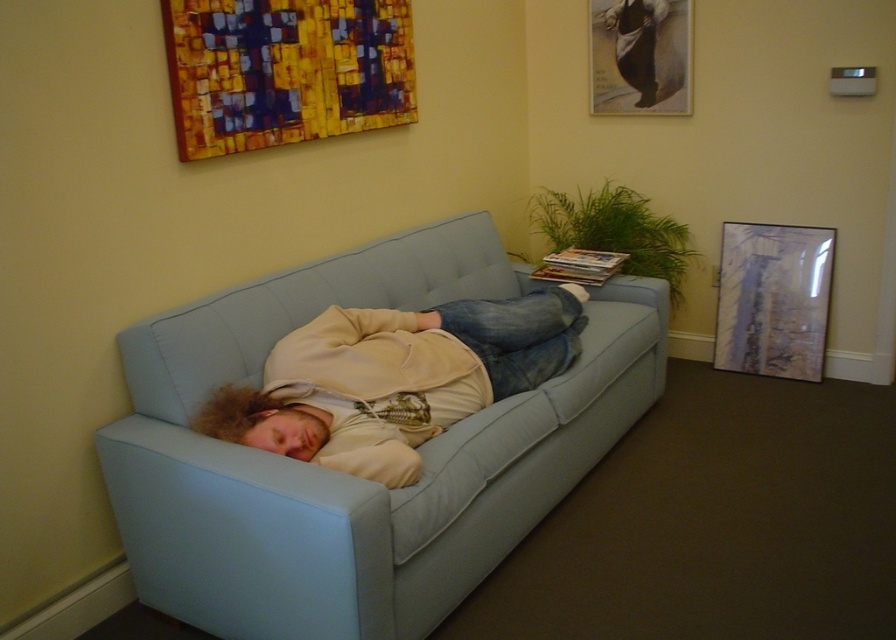
Consider the image. You are a delivery person who needs to place a small package on the table next to the sofa. The table is currently occupied by the beige fleece jacket at center and the matte glass picture frame at upper right. Which object should you move to make space?

You should move the beige fleece jacket at center because it might be wider than the matte glass picture frame at upper right, so moving it would free up more space for the package.

You are a guest in this room and want to take the matte paper picture frame at upper right off the wall to look at it closer. However, you need to first move the beige fleece jacket at center out of the way. Is the jacket currently blocking access to the frame?

The beige fleece jacket at center is positioned under the matte paper picture frame at upper right, so it is not blocking the frame. You can safely remove the frame without moving the jacket.

You are a guest in this room and want to place your beige fleece jacket at center and matte glass picture frame at upper right on a shelf. The shelf can only hold one item. Which item should you choose to place on the shelf to ensure it fits?

The beige fleece jacket at center is bigger than the matte glass picture frame at upper right, so you should choose the matte glass picture frame at upper right to place on the shelf since it is smaller and more likely to fit.